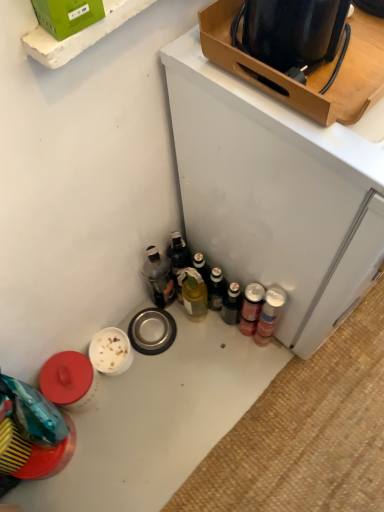
The image size is (384, 512). Identify the location of free location in front of metallic silver can at lower right, the 4th bottle in the left-to-right sequence. (270, 395).